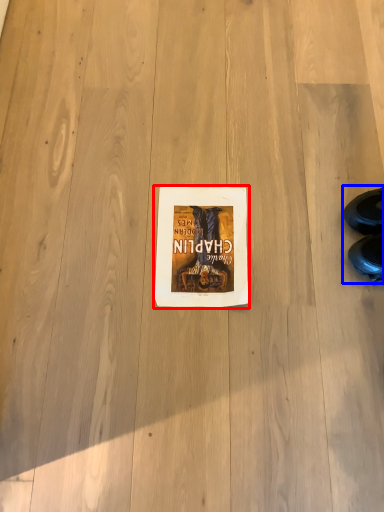
Question: Among these objects, which one is nearest to the camera, paperback book (highlighted by a red box) or leather shoe (highlighted by a blue box)?

Choices:
 (A) paperback book
 (B) leather shoe

Answer: (B)